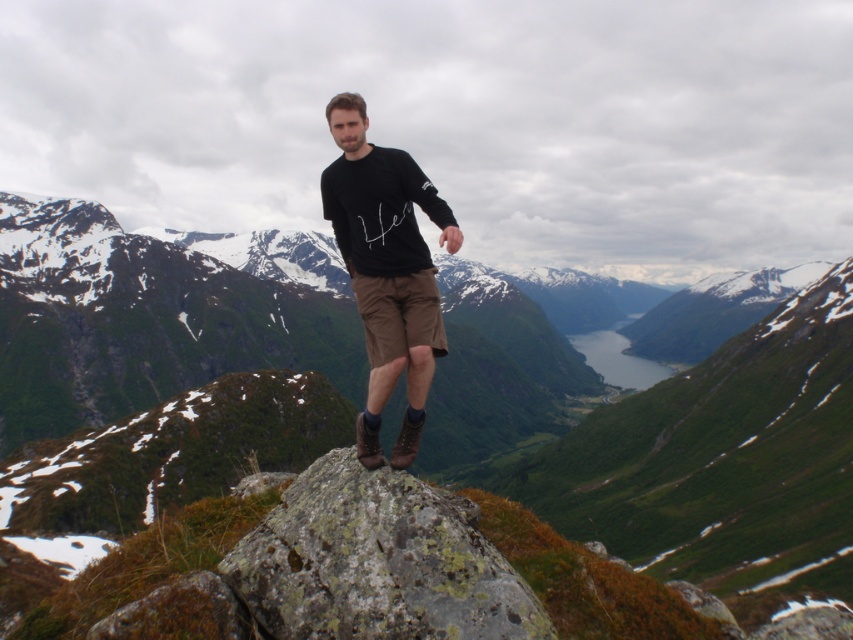
Looking at this image, is rugged stone mountain at center taller than rusty rock at center?

Yes, rugged stone mountain at center is taller than rusty rock at center.

Is rugged stone mountain at center further to the viewer compared to rusty rock at center?

Yes, it is behind rusty rock at center.

Image resolution: width=853 pixels, height=640 pixels. What do you see at coordinates (659, 428) in the screenshot? I see `rugged stone mountain at center` at bounding box center [659, 428].

This screenshot has height=640, width=853. In order to click on rugged stone mountain at center in this screenshot , I will do `click(659, 428)`.

From the picture: Who is taller, rugged stone mountain at center or black cotton shirt at center?

rugged stone mountain at center

In the scene shown: Between rugged stone mountain at center and black cotton shirt at center, which one has less height?

black cotton shirt at center is shorter.

Is point (813, 518) positioned after point (390, 332)?

Yes.

Where is `rugged stone mountain at center`? This screenshot has height=640, width=853. rugged stone mountain at center is located at coordinates (659, 428).

Consider the image. Is rusty rock at center smaller than black cotton shirt at center?

Yes, rusty rock at center is smaller than black cotton shirt at center.

The height and width of the screenshot is (640, 853). What do you see at coordinates (376, 563) in the screenshot?
I see `rusty rock at center` at bounding box center [376, 563].

Who is more forward, (267, 605) or (407, 408)?

Positioned in front is point (267, 605).

What are the coordinates of `rusty rock at center` in the screenshot? It's located at (376, 563).